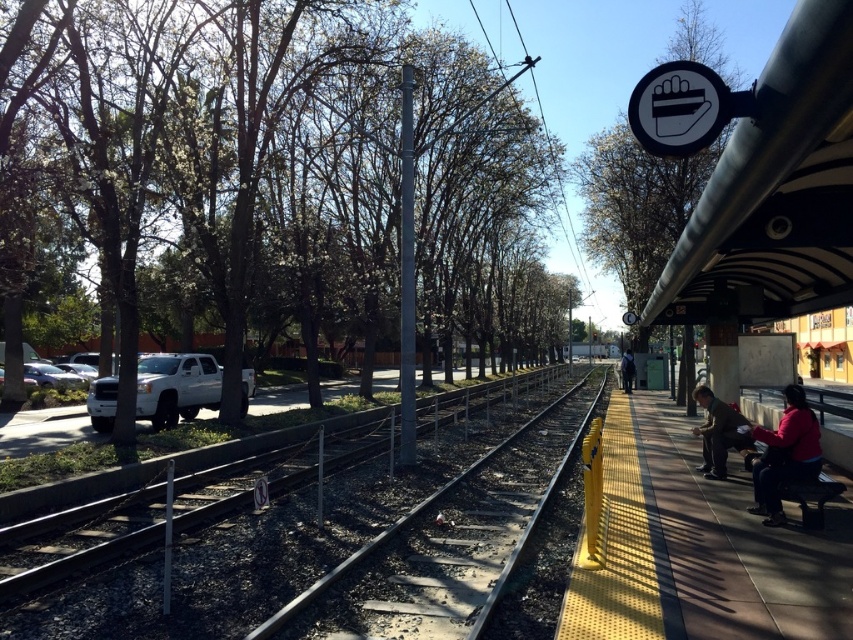
You are a photographer standing on the train station platform. You notice the dark brown leather jacket at lower right and the dark blue jeans at right. Which clothing item is positioned higher relative to the other?

The dark brown leather jacket at lower right is positioned higher than the dark blue jeans at right.